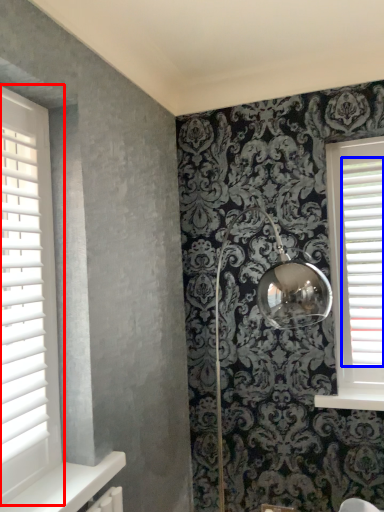
Question: Which of the following is the farthest to the observer, window (highlighted by a red box) or blind (highlighted by a blue box)?

Choices:
 (A) window
 (B) blind

Answer: (B)